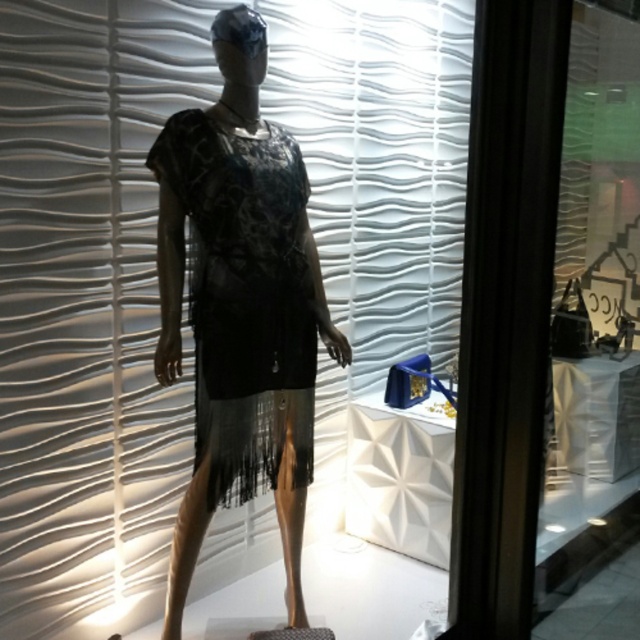
You are a customer looking at the store window display. You see the white matte blind at upper center and the black lace dress at center. Which object is closer to you from your viewpoint?

The white matte blind at upper center is closer to you because it is in front of the black lace dress at center.

You are standing in front of the store window and see two points marked in the scene. The first point is at coordinates point (456, 333) and the second point is at point (324, 308). Which point is closer to your eyes?

Point (456, 333) is further to the camera than point (324, 308), so the point closer to your eyes is point (324, 308).